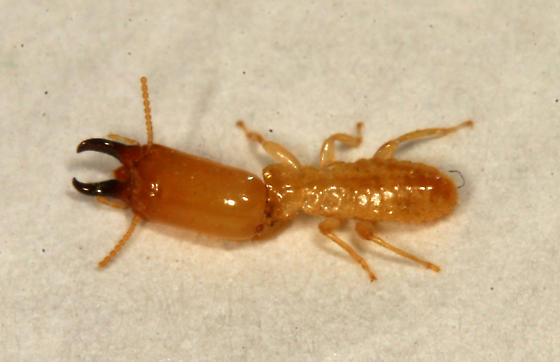
Image resolution: width=560 pixels, height=362 pixels. I want to click on table bug is sitting on, so click(235, 298).